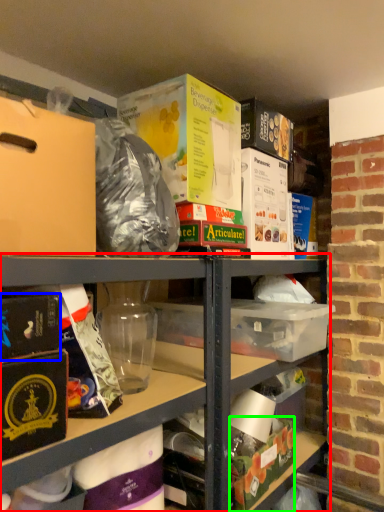
Question: Which is farther away from shelf (highlighted by a red box)? paperback book (highlighted by a blue box) or box (highlighted by a green box)?

Choices:
 (A) paperback book
 (B) box

Answer: (A)